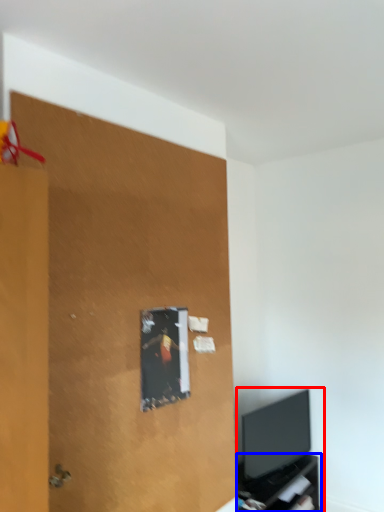
Question: Which object appears closest to the camera in this image, entertainment center (highlighted by a red box) or tv cabinet (highlighted by a blue box)?

Choices:
 (A) entertainment center
 (B) tv cabinet

Answer: (B)